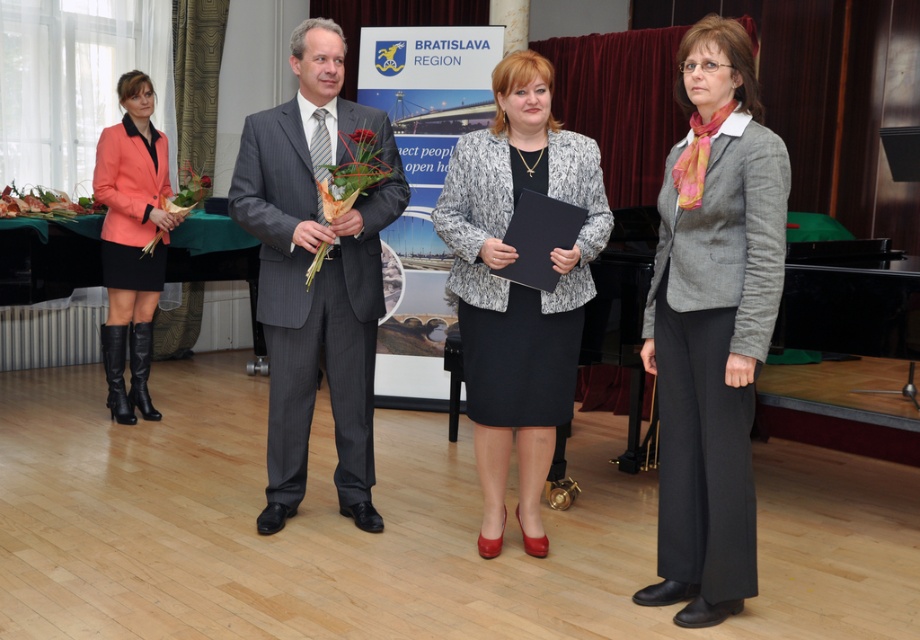
Question: Can you confirm if speckled woolen blazer at center is wider than matte green bouquet at center?

Choices:
 (A) yes
 (B) no

Answer: (A)

Question: Which of the following is the farthest from the observer?

Choices:
 (A) (355, 141)
 (B) (203, 176)
 (C) (311, 387)
 (D) (584, 289)

Answer: (B)

Question: Among these points, which one is farthest from the camera?

Choices:
 (A) (584, 220)
 (B) (207, 186)

Answer: (B)

Question: Can you confirm if gray woolen blazer at center is positioned to the left of gray pinstripe suit at center?

Choices:
 (A) yes
 (B) no

Answer: (B)

Question: Can you confirm if matte green bouquet at center is thinner than green leafy bouquet at center?

Choices:
 (A) no
 (B) yes

Answer: (A)

Question: Considering the real-world distances, which object is closest to the gray pinstripe suit at center?

Choices:
 (A) green leafy bouquet at center
 (B) gray woolen blazer at center
 (C) matte orange blazer at left
 (D) speckled woolen blazer at center

Answer: (D)